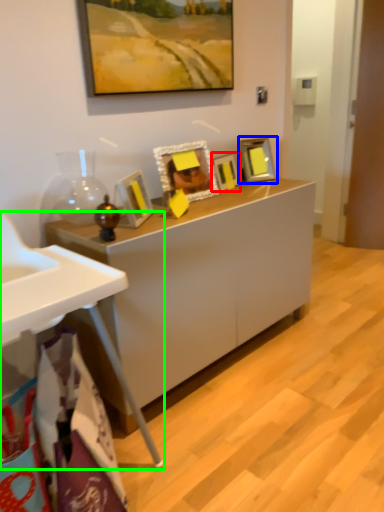
Question: Which object is the closest to the picture frame (highlighted by a red box)? Choose among these: picture frame (highlighted by a blue box) or table (highlighted by a green box).

Choices:
 (A) picture frame
 (B) table

Answer: (A)